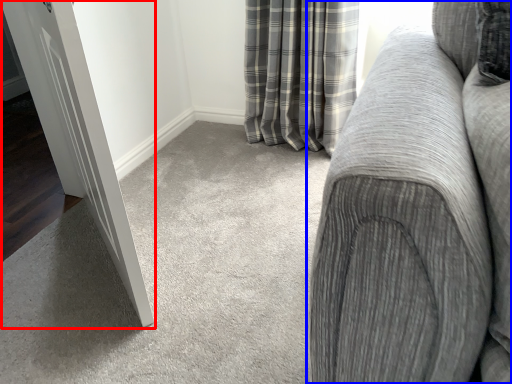
Question: Which point is further to the camera, door (highlighted by a red box) or studio couch (highlighted by a blue box)?

Choices:
 (A) door
 (B) studio couch

Answer: (A)